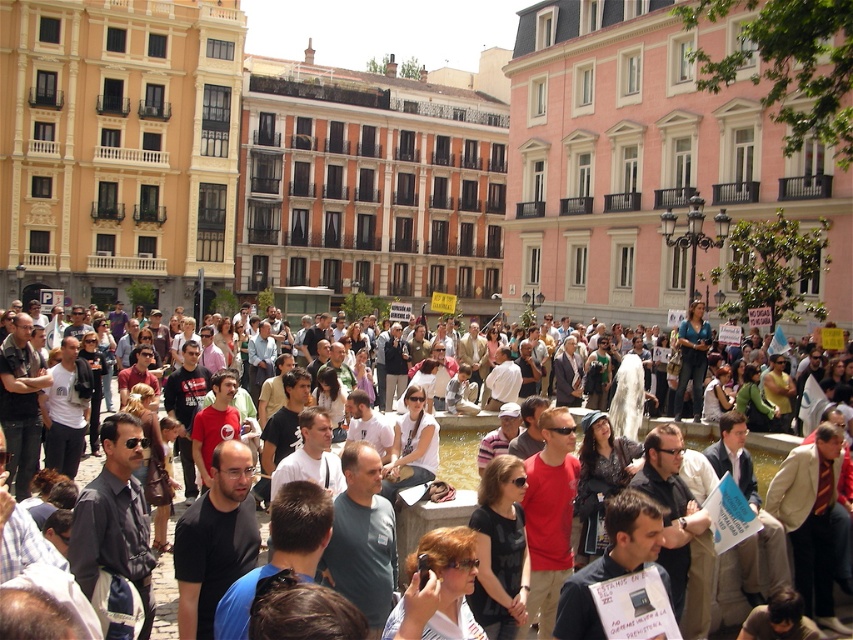
I want to click on matte black phone at center, so 450,580.

Does point (476, 536) lie in front of point (610, 468)?

Yes, it is in front of point (610, 468).

Find the location of a particular element. Image resolution: width=853 pixels, height=640 pixels. matte black phone at center is located at coordinates 450,580.

Does black fabric shirt at center have a smaller size compared to matte white shirt at center?

Indeed, black fabric shirt at center has a smaller size compared to matte white shirt at center.

Can you confirm if black fabric shirt at center is wider than matte white shirt at center?

Incorrect, black fabric shirt at center's width does not surpass matte white shirt at center's.

Between point (480, 515) and point (436, 435), which one is positioned behind?

Positioned behind is point (436, 435).

Find the location of a particular element. This screenshot has height=640, width=853. black fabric shirt at center is located at coordinates (500, 548).

Between point (485, 612) and point (444, 540), which one is positioned in front?

Positioned in front is point (444, 540).

Does point (480, 560) lie behind point (461, 596)?

Yes, it is behind point (461, 596).

Who is more forward, (480, 518) or (389, 634)?

Positioned in front is point (389, 634).

The image size is (853, 640). I want to click on black fabric shirt at center, so click(x=500, y=548).